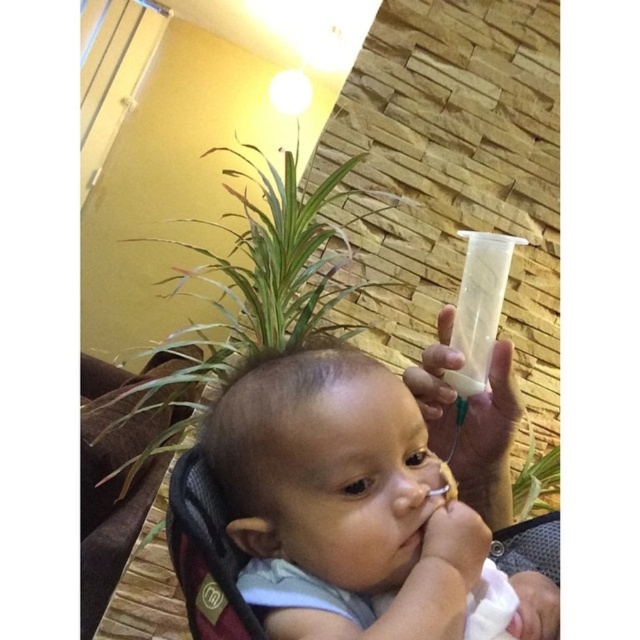
Based on the photo, you are a parent trying to choose between placing a new decoration either next to the green leafy plant at upper left or near the green leafy plant at center. Based on their sizes, which location would allow for a larger decoration?

The green leafy plant at upper left is larger than the green leafy plant at center, so placing a larger decoration next to it would be more appropriate.

You are a parent holding a smooth plastic bottle at upper right that you want to place on a shelf. The shelf is 35 centimeters away from you. Can you place the bottle on the shelf?

The smooth plastic bottle at upper right is 37.69 centimeters from viewer, so it is further away than the shelf which is 35 centimeters away. You cannot place the bottle on the shelf because it is beyond the shelf.